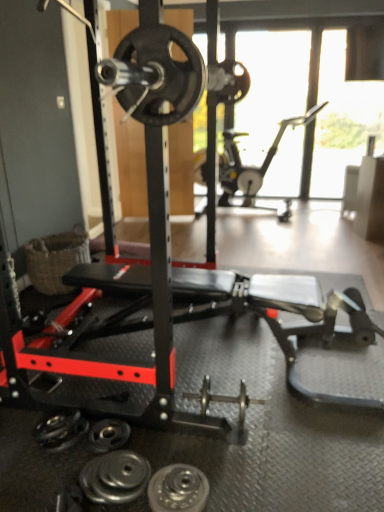
Question: Does metallic silver exercise bike at upper right have a greater width compared to polished silver dumbbell at center, the 2th dumbbell when ordered from left to right?

Choices:
 (A) yes
 (B) no

Answer: (A)

Question: From a real-world perspective, is metallic silver exercise bike at upper right under polished silver dumbbell at center, the first dumbbell from the back?

Choices:
 (A) yes
 (B) no

Answer: (B)

Question: Can you confirm if metallic silver exercise bike at upper right is shorter than polished silver dumbbell at center, the 1th dumbbell viewed from the top?

Choices:
 (A) yes
 (B) no

Answer: (B)

Question: Can you confirm if metallic silver exercise bike at upper right is taller than polished silver dumbbell at center, which appears as the 2th dumbbell when ordered from the bottom?

Choices:
 (A) yes
 (B) no

Answer: (A)

Question: From the image's perspective, is metallic silver exercise bike at upper right located beneath polished silver dumbbell at center, the 2th dumbbell when ordered from left to right?

Choices:
 (A) yes
 (B) no

Answer: (B)

Question: Is metallic silver exercise bike at upper right looking in the opposite direction of polished silver dumbbell at center, the first dumbbell from the back?

Choices:
 (A) yes
 (B) no

Answer: (B)

Question: From the image's perspective, does woven brown basket at lower left appear lower than polished silver dumbbell at lower left, arranged as the 2th dumbbell when viewed from the top?

Choices:
 (A) yes
 (B) no

Answer: (B)

Question: Considering the relative sizes of woven brown basket at lower left and polished silver dumbbell at lower left, acting as the 1th dumbbell starting from the front, in the image provided, is woven brown basket at lower left taller than polished silver dumbbell at lower left, acting as the 1th dumbbell starting from the front,?

Choices:
 (A) no
 (B) yes

Answer: (B)

Question: Considering the relative sizes of woven brown basket at lower left and polished silver dumbbell at lower left, the 2th dumbbell from the back, in the image provided, is woven brown basket at lower left wider than polished silver dumbbell at lower left, the 2th dumbbell from the back,?

Choices:
 (A) yes
 (B) no

Answer: (A)

Question: Is woven brown basket at lower left outside of polished silver dumbbell at lower left, which appears as the 1th dumbbell when ordered from the bottom?

Choices:
 (A) yes
 (B) no

Answer: (A)

Question: Is woven brown basket at lower left smaller than polished silver dumbbell at lower left, the first dumbbell viewed from the left?

Choices:
 (A) no
 (B) yes

Answer: (A)

Question: Is the depth of woven brown basket at lower left greater than that of polished silver dumbbell at lower left, which appears as the 1th dumbbell when ordered from the bottom?

Choices:
 (A) no
 (B) yes

Answer: (B)

Question: Can you confirm if black rubber weight plate at lower center, the 2th wheel when ordered from front to back, is wider than metallic silver exercise bike at upper right?

Choices:
 (A) yes
 (B) no

Answer: (B)